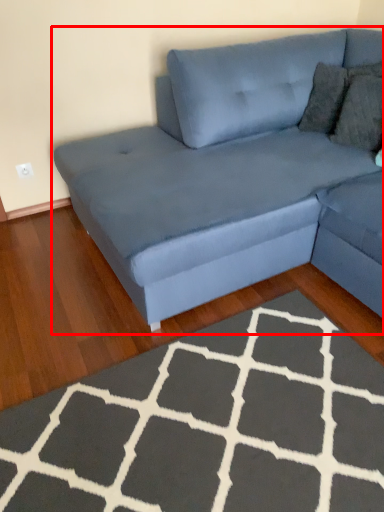
Question: From the image's perspective, what is the correct spatial relationship of studio couch (annotated by the red box) in relation to doormat?

Choices:
 (A) below
 (B) above

Answer: (B)